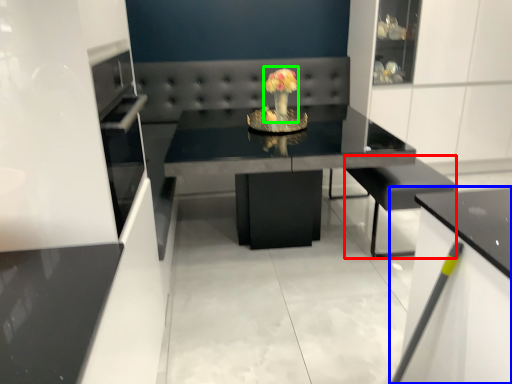
Question: Which object is positioned closest to armchair (highlighted by a red box)? Select from cabinetry (highlighted by a blue box) and floral arrangement (highlighted by a green box).

Choices:
 (A) cabinetry
 (B) floral arrangement

Answer: (A)